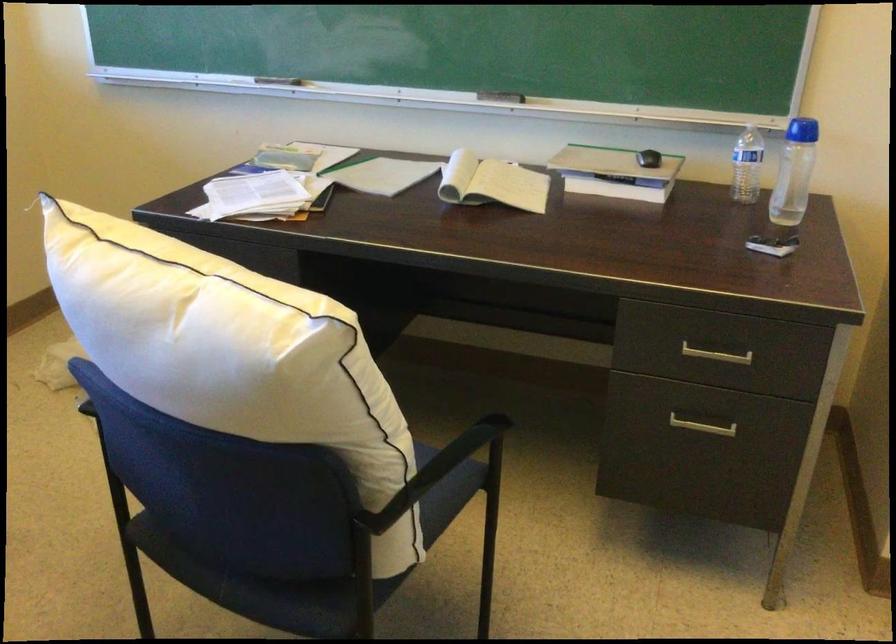
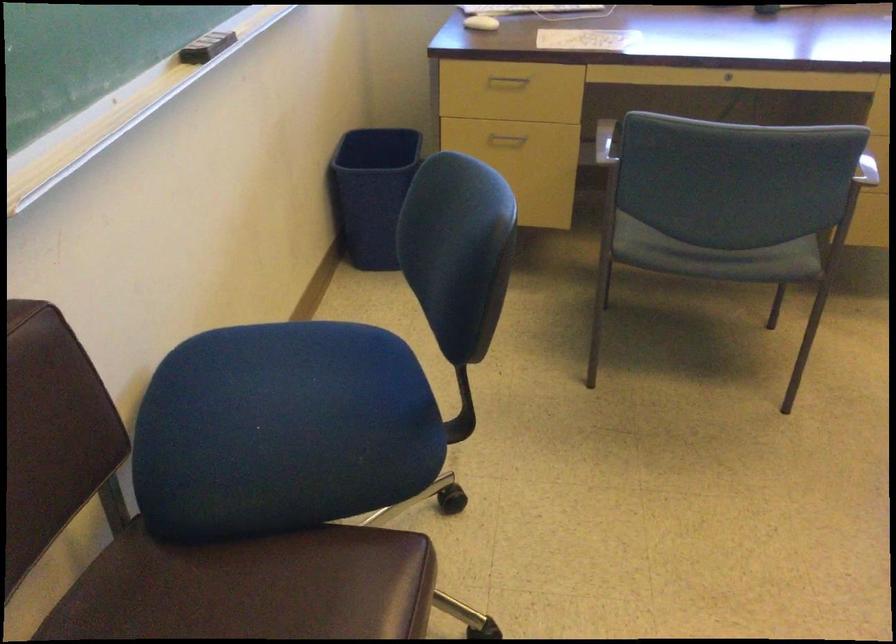
How did the camera likely rotate?

The camera's rotation is toward left-down.